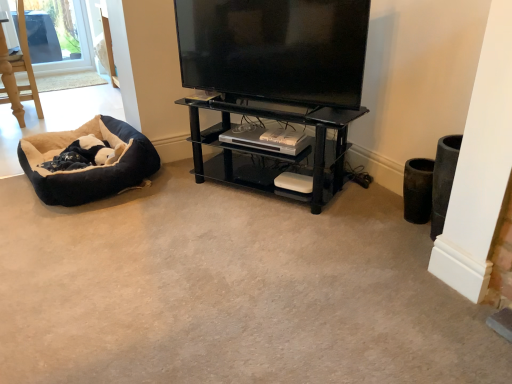
Question: Is black glass shelf at center bigger or smaller than black glossy flat-screen tv at upper center?

Choices:
 (A) big
 (B) small

Answer: (A)

Question: In terms of height, does black glass shelf at center look taller or shorter compared to black glossy flat-screen tv at upper center?

Choices:
 (A) tall
 (B) short

Answer: (A)

Question: Considering the real-world distances, which object is closest to the black glass shelf at center?

Choices:
 (A) soft plush dog bed at left
 (B) black glossy flat-screen tv at upper center
 (C) black plush dog bed at lower left

Answer: (B)

Question: Estimate the real-world distances between objects in this image. Which object is closer to the soft plush dog bed at left?

Choices:
 (A) black glossy flat-screen tv at upper center
 (B) black glass shelf at center
 (C) black plush dog bed at lower left

Answer: (C)